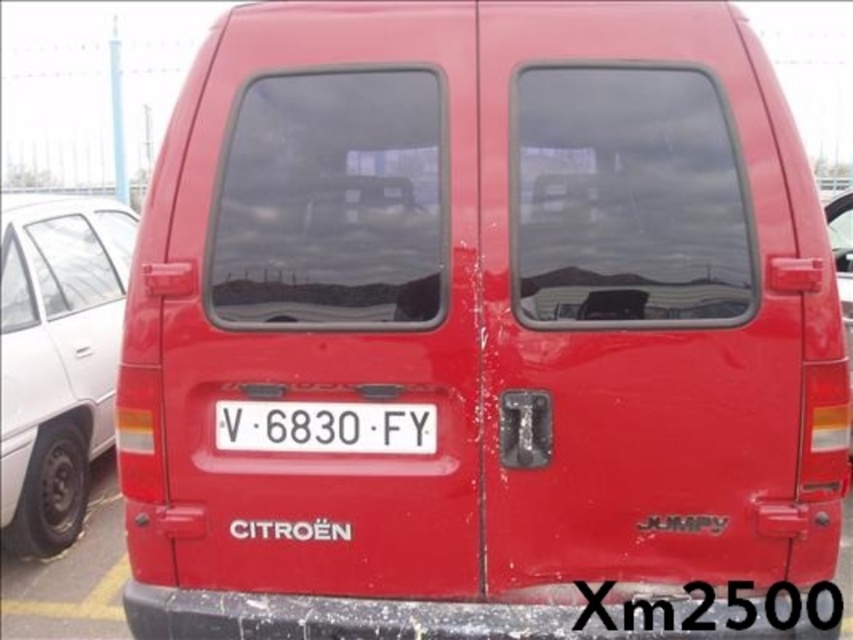
Consider the image. Is matte white car at left behind white plastic license plate at center?

Yes, it is behind white plastic license plate at center.

Is point (19, 419) less distant than point (239, 433)?

No, it is not.

Locate an element on the screen. matte white car at left is located at coordinates (57, 358).